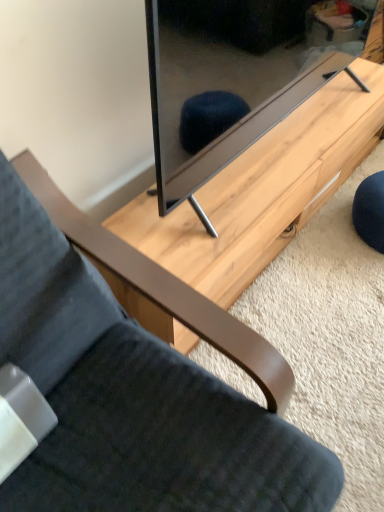
Question: From a real-world perspective, is matte black tv at center above or below velvet dark gray chair at lower left?

Choices:
 (A) above
 (B) below

Answer: (A)

Question: Considering their positions, is matte black tv at center located in front of or behind velvet dark gray chair at lower left?

Choices:
 (A) behind
 (B) front

Answer: (A)

Question: Estimate the real-world distances between objects in this image. Which object is farther from the light wood table at center?

Choices:
 (A) matte black tv at center
 (B) velvet dark gray chair at lower left

Answer: (B)

Question: Estimate the real-world distances between objects in this image. Which object is closer to the matte black tv at center?

Choices:
 (A) velvet dark gray chair at lower left
 (B) light wood table at center

Answer: (B)